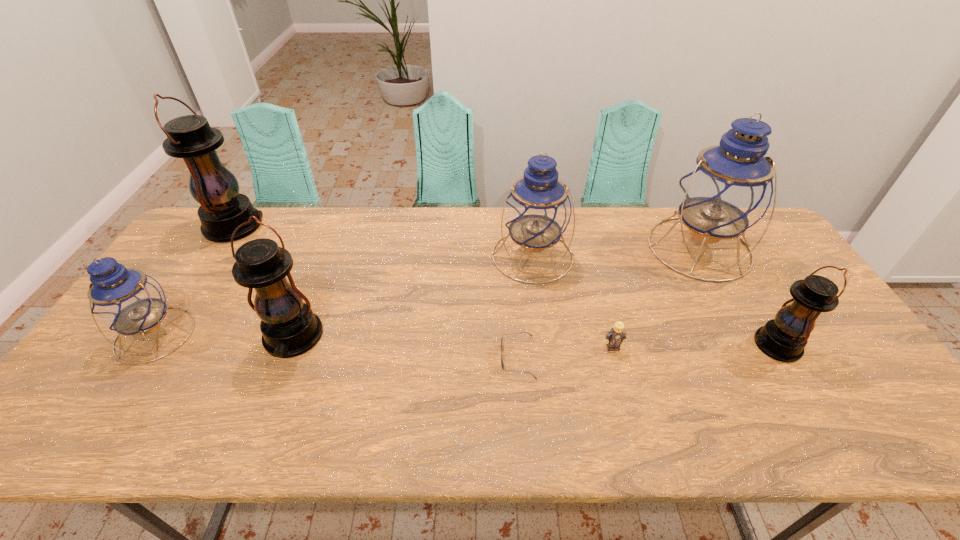
Can you find a vacant point located 0.380m above the rightmost black lantern, indicating its light source? Please provide its 2D coordinates. Your answer should be formatted as a tuple, i.e. [(x, y)], where the tuple contains the x and y coordinates of a point satisfying the conditions above.

[(605, 345)]

Identify the location of vacant position located 0.060m on the front-facing side of the nearest blue lantern. [121, 386].

Locate an element on the screen. The width and height of the screenshot is (960, 540). free space located in front of the sixth object from left to right is located at coordinates pos(618,371).

Identify the location of free space located 0.050m on the lenses of the shortest object. (480, 357).

Where is `vacant space located 0.140m on the lenses of the shortest object`? The image size is (960, 540). vacant space located 0.140m on the lenses of the shortest object is located at coordinates (x=444, y=357).

Find the location of `free space located on the lenses of the shortest object`. free space located on the lenses of the shortest object is located at coordinates point(409,357).

I want to click on object that is positioned at the far left corner, so click(x=223, y=209).

At what (x,y) coordinates should I click in order to perform the action: click on object that is at the far right corner. Please return your answer as a coordinate pair (x, y). The image size is (960, 540). Looking at the image, I should click on (730, 186).

Where is `free space at the far edge`? This screenshot has width=960, height=540. free space at the far edge is located at coordinates (464, 230).

In the image, there is a desktop. At what (x,y) coordinates should I click in order to perform the action: click on vacant space at the left edge. Please return your answer as a coordinate pair (x, y). Looking at the image, I should click on (173, 271).